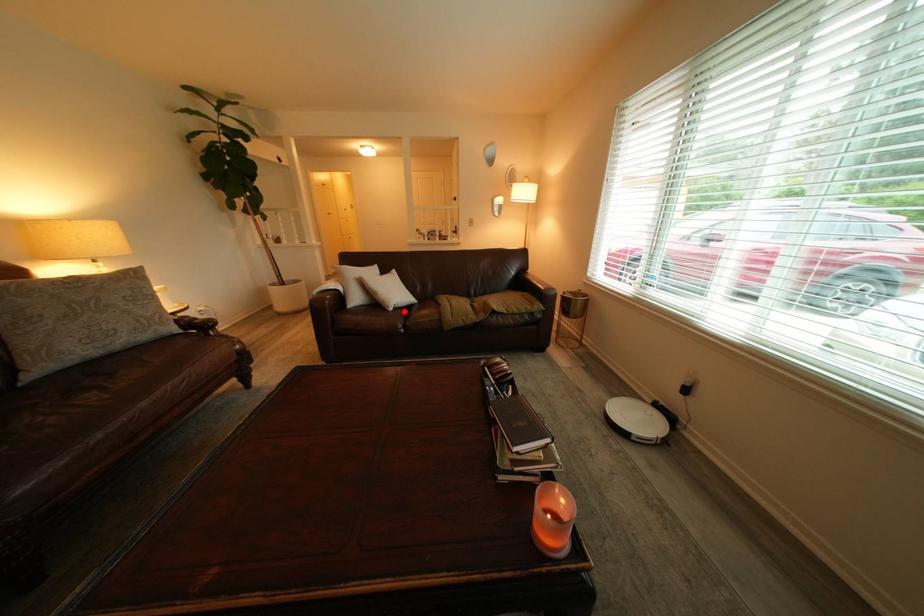
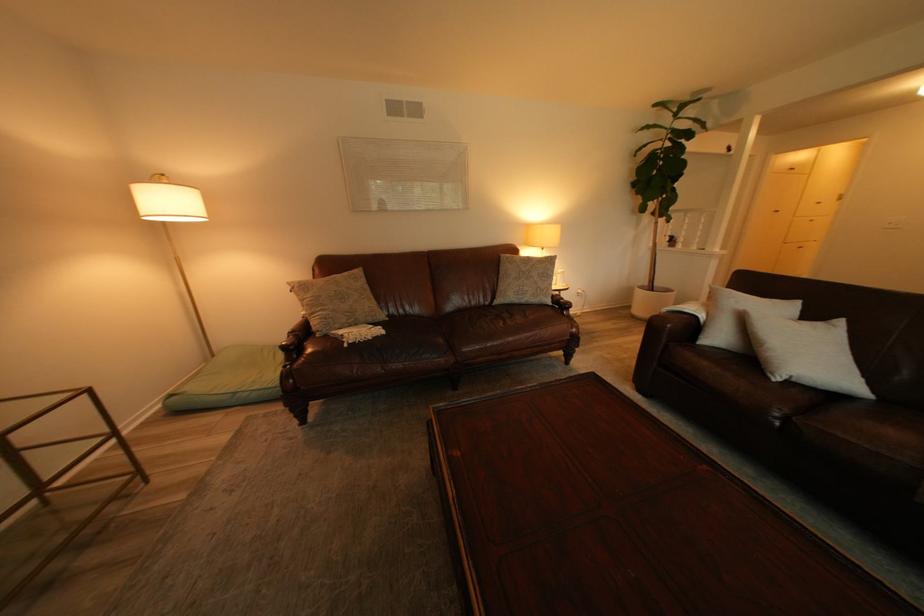
Question: A red point is marked in image1. In image2, is the corresponding 3D point closer to the camera or farther? Reply with the corresponding letter.

Choices:
 (A) The corresponding 3D point is closer.
 (B) The corresponding 3D point is farther.

Answer: (B)